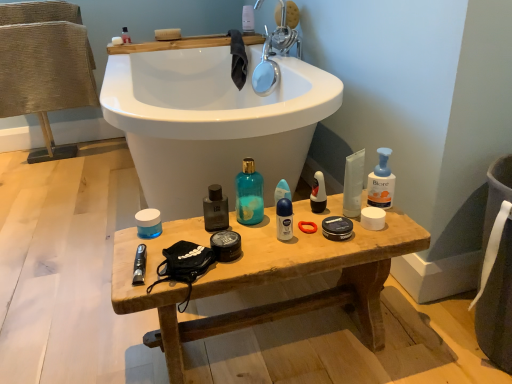
Find the location of `vacant area that lies to the right of teal glass bottle at center, arranged as the third cleaning product when viewed from the right`. vacant area that lies to the right of teal glass bottle at center, arranged as the third cleaning product when viewed from the right is located at coordinates (309, 220).